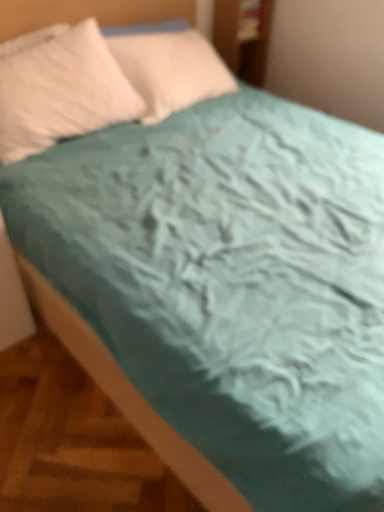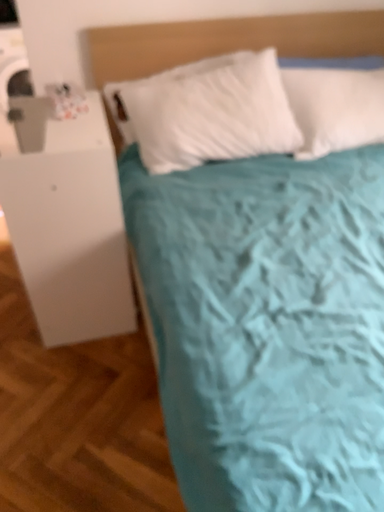
Question: Which way did the camera rotate in the video?

Choices:
 (A) rotated right
 (B) rotated left

Answer: (B)